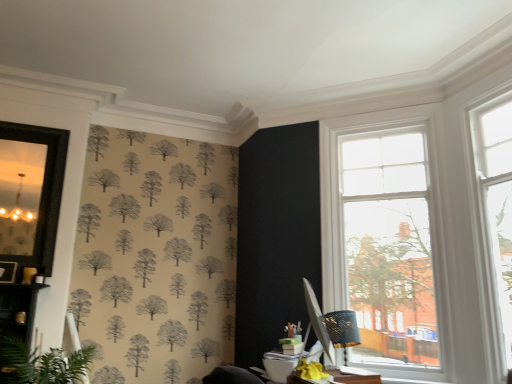
You are a GUI agent. You are given a task and a screenshot of the screen. Output one action in this format:
    pyautogui.click(x=<x>, y=<y>)
    Task: Click on the blank space situated above matte black mirror at left (from a real-world perspective)
    
    Given the screenshot: What is the action you would take?
    pyautogui.click(x=31, y=126)